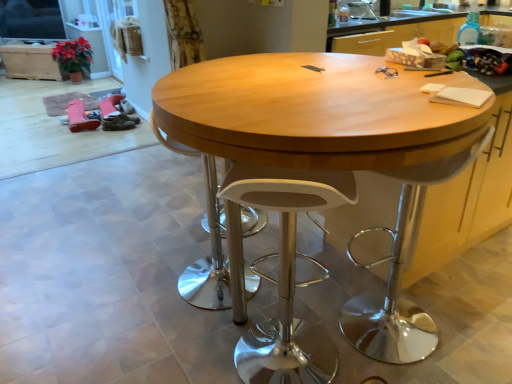
Question: From a real-world perspective, is white plastic swivel chair at center, the second swivel chair viewed from the right, on white plastic swivel chair at right, which is counted as the 2th swivel chair, starting from the left?

Choices:
 (A) no
 (B) yes

Answer: (A)

Question: Is white plastic swivel chair at center, the first swivel chair when ordered from left to right, in contact with white plastic swivel chair at right, which is counted as the 2th swivel chair, starting from the left?

Choices:
 (A) no
 (B) yes

Answer: (A)

Question: Is white plastic swivel chair at center, the first swivel chair when ordered from left to right, surrounding white plastic swivel chair at right, which is counted as the 2th swivel chair, starting from the left?

Choices:
 (A) yes
 (B) no

Answer: (B)

Question: From the image's perspective, is white plastic swivel chair at center, the first swivel chair when ordered from left to right, below white plastic swivel chair at right, which is counted as the 2th swivel chair, starting from the left?

Choices:
 (A) yes
 (B) no

Answer: (B)

Question: Is white plastic swivel chair at center, the second swivel chair viewed from the right, closer to camera compared to white plastic swivel chair at right, the first swivel chair in the right-to-left sequence?

Choices:
 (A) no
 (B) yes

Answer: (A)

Question: From the image's perspective, relative to white plastic stool at center, is wooden table at center above or below?

Choices:
 (A) above
 (B) below

Answer: (A)

Question: In terms of width, does wooden table at center look wider or thinner when compared to white plastic stool at center?

Choices:
 (A) wide
 (B) thin

Answer: (A)

Question: Considering their positions, is wooden table at center located in front of or behind white plastic stool at center?

Choices:
 (A) front
 (B) behind

Answer: (A)

Question: Is wooden table at center taller or shorter than white plastic stool at center?

Choices:
 (A) tall
 (B) short

Answer: (A)

Question: Is white plastic swivel chair at right, the first swivel chair in the right-to-left sequence, wider or thinner than wooden cabinet at upper left?

Choices:
 (A) thin
 (B) wide

Answer: (A)

Question: From a real-world perspective, is white plastic swivel chair at right, the first swivel chair in the right-to-left sequence, above or below wooden cabinet at upper left?

Choices:
 (A) above
 (B) below

Answer: (A)

Question: Is white plastic swivel chair at right, which is counted as the 2th swivel chair, starting from the left, inside or outside of wooden cabinet at upper left?

Choices:
 (A) outside
 (B) inside

Answer: (A)

Question: Is point (344, 324) positioned closer to the camera than point (31, 74)?

Choices:
 (A) farther
 (B) closer

Answer: (B)

Question: Is point (463, 162) closer or farther from the camera than point (194, 276)?

Choices:
 (A) farther
 (B) closer

Answer: (B)

Question: Considering the positions of white plastic swivel chair at right, which is counted as the 2th swivel chair, starting from the left, and white plastic swivel chair at center, the second swivel chair viewed from the right, in the image, is white plastic swivel chair at right, which is counted as the 2th swivel chair, starting from the left, bigger or smaller than white plastic swivel chair at center, the second swivel chair viewed from the right,?

Choices:
 (A) big
 (B) small

Answer: (B)